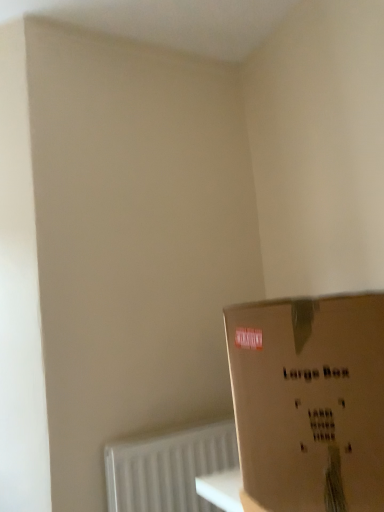
What do you see at coordinates (309, 401) in the screenshot?
I see `brown cardboard box at lower right` at bounding box center [309, 401].

Identify the location of brown cardboard box at lower right. (309, 401).

What do you see at coordinates (168, 468) in the screenshot? I see `white textured radiator at lower left` at bounding box center [168, 468].

Measure the distance between white textured radiator at lower left and camera.

The distance of white textured radiator at lower left from camera is 4.70 feet.

Where is `white textured radiator at lower left`? white textured radiator at lower left is located at coordinates (168, 468).

You are a GUI agent. You are given a task and a screenshot of the screen. Output one action in this format:
    pyautogui.click(x=<x>, y=<y>)
    Task: Click on the brown cardboard box at lower right
    The width and height of the screenshot is (384, 512).
    Given the screenshot: What is the action you would take?
    pyautogui.click(x=309, y=401)

Which is more to the right, white textured radiator at lower left or brown cardboard box at lower right?

brown cardboard box at lower right.

Is white textured radiator at lower left in front of or behind brown cardboard box at lower right in the image?

white textured radiator at lower left is positioned farther from the viewer than brown cardboard box at lower right.

Considering the positions of point (132, 442) and point (262, 452), is point (132, 442) closer or farther from the camera than point (262, 452)?

Point (132, 442) is positioned farther from the camera compared to point (262, 452).

From the image's perspective, is white textured radiator at lower left located above or below brown cardboard box at lower right?

white textured radiator at lower left is below brown cardboard box at lower right.

From a real-world perspective, is white textured radiator at lower left below brown cardboard box at lower right?

Correct, in the physical world, white textured radiator at lower left is lower than brown cardboard box at lower right.

Is white textured radiator at lower left thinner than brown cardboard box at lower right?

Yes.

Does white textured radiator at lower left have a lesser height compared to brown cardboard box at lower right?

Correct, white textured radiator at lower left is not as tall as brown cardboard box at lower right.

Which of these two, white textured radiator at lower left or brown cardboard box at lower right, is bigger?

With larger size is brown cardboard box at lower right.

Would you say white textured radiator at lower left is inside or outside brown cardboard box at lower right?

white textured radiator at lower left is spatially situated outside brown cardboard box at lower right.

Are white textured radiator at lower left and brown cardboard box at lower right far apart?

That's not correct — white textured radiator at lower left is a little close to brown cardboard box at lower right.

Does white textured radiator at lower left turn towards brown cardboard box at lower right?

Yes.

I want to click on radiator lying below the brown cardboard box at lower right (from the image's perspective), so click(x=168, y=468).

Considering the relative positions of brown cardboard box at lower right and white textured radiator at lower left in the image provided, is brown cardboard box at lower right to the right of white textured radiator at lower left from the viewer's perspective?

Yes.

Is the position of brown cardboard box at lower right more distant than that of white textured radiator at lower left?

No, it is in front of white textured radiator at lower left.

Which is behind, point (382, 365) or point (149, 480)?

Point (149, 480)

From the image's perspective, is brown cardboard box at lower right on top of white textured radiator at lower left?

Yes, from the image's perspective, brown cardboard box at lower right is on top of white textured radiator at lower left.

From a real-world perspective, is brown cardboard box at lower right located beneath white textured radiator at lower left?

Incorrect, from a real-world perspective, brown cardboard box at lower right is higher than white textured radiator at lower left.

Which of these two, brown cardboard box at lower right or white textured radiator at lower left, is wider?

With larger width is brown cardboard box at lower right.

In the scene shown: Who is taller, brown cardboard box at lower right or white textured radiator at lower left?

Standing taller between the two is brown cardboard box at lower right.

Does brown cardboard box at lower right have a smaller size compared to white textured radiator at lower left?

No, brown cardboard box at lower right is not smaller than white textured radiator at lower left.

Is brown cardboard box at lower right inside the boundaries of white textured radiator at lower left, or outside?

brown cardboard box at lower right lies outside white textured radiator at lower left.

Is brown cardboard box at lower right not near white textured radiator at lower left?

That's not correct — brown cardboard box at lower right is a little close to white textured radiator at lower left.

Is brown cardboard box at lower right aimed at white textured radiator at lower left?

No, brown cardboard box at lower right does not turn towards white textured radiator at lower left.

Can you tell me how much brown cardboard box at lower right and white textured radiator at lower left differ in facing direction?

50.8 degrees separate the facing orientations of brown cardboard box at lower right and white textured radiator at lower left.

How much distance is there between brown cardboard box at lower right and white textured radiator at lower left?

brown cardboard box at lower right is 24.76 inches from white textured radiator at lower left.

At what (x,y) coordinates should I click in order to perform the action: click on radiator that is under the brown cardboard box at lower right (from a real-world perspective). Please return your answer as a coordinate pair (x, y). The image size is (384, 512). Looking at the image, I should click on (168, 468).

This screenshot has height=512, width=384. What are the coordinates of `box lying above the white textured radiator at lower left (from the image's perspective)` in the screenshot? It's located at (309, 401).

Identify the location of box on the right of the white textured radiator at lower left. (309, 401).